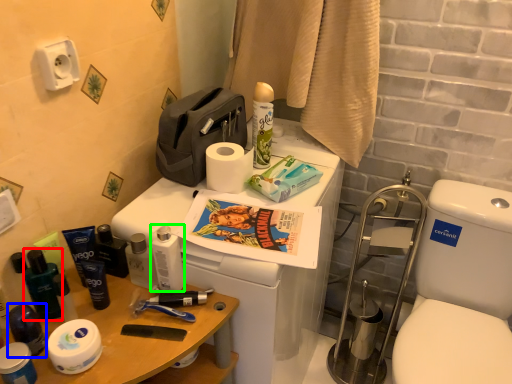
Question: Based on their relative distances, which object is farther from toiletry (highlighted by a red box)? Choose from toiletry (highlighted by a blue box) and toiletry (highlighted by a green box).

Choices:
 (A) toiletry
 (B) toiletry

Answer: (B)